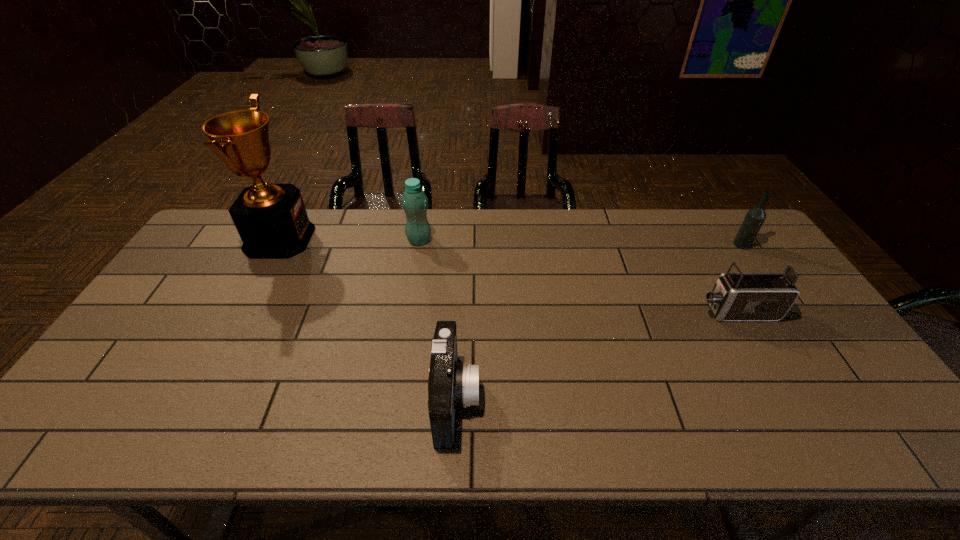
Find the location of a particular element. This screenshot has width=960, height=540. free space that satisfies the following two spatial constraints: 1. at the front cap of the vodka; 2. on the left side of the water bottle is located at coordinates (419, 245).

The width and height of the screenshot is (960, 540). Identify the location of vacant area that satisfies the following two spatial constraints: 1. on the front of the trophy cup with the label; 2. on the right side of the rightmost object. (276, 245).